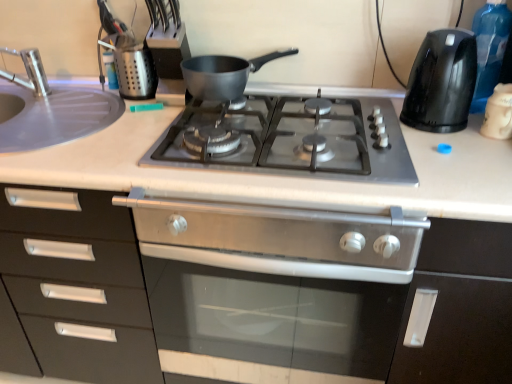
Where is `vacant area that lies to the right of silver metallic faucet at left`? This screenshot has width=512, height=384. vacant area that lies to the right of silver metallic faucet at left is located at coordinates (64, 103).